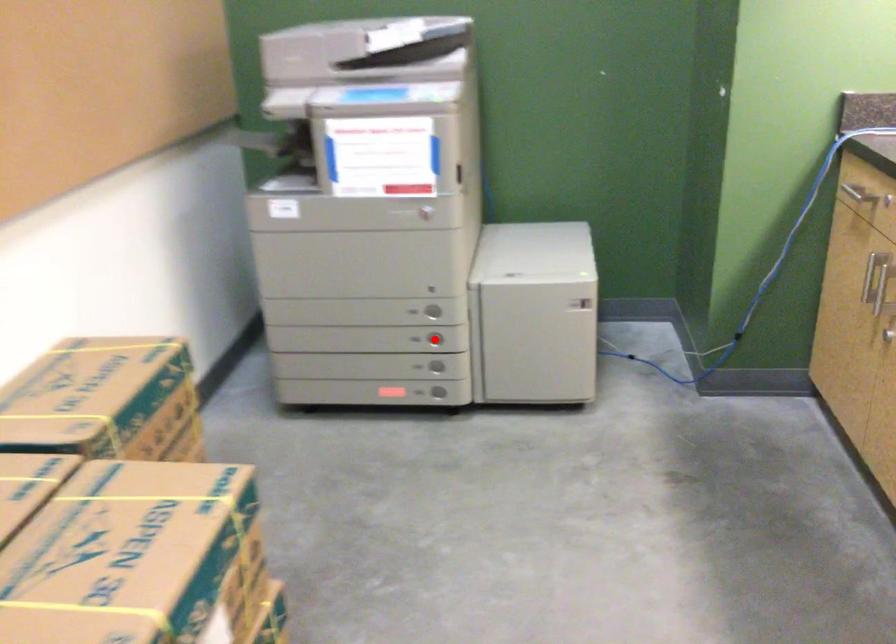
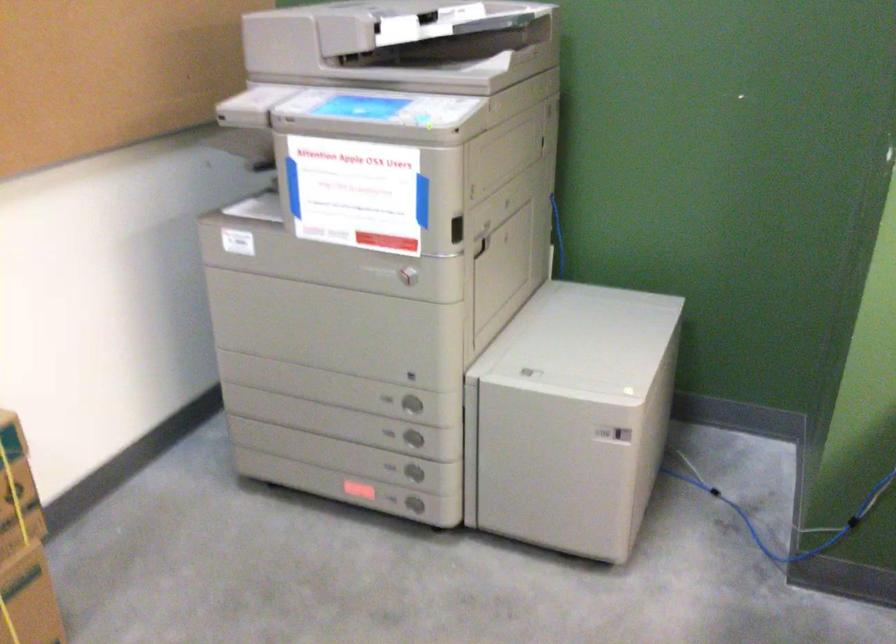
Question: I am providing you with two images of the same scene from different viewpoints. Image1 has a red point marked. In image2, the corresponding 3D location appears at what relative position? Reply with the corresponding letter.

Choices:
 (A) Closer
 (B) Farther

Answer: (A)